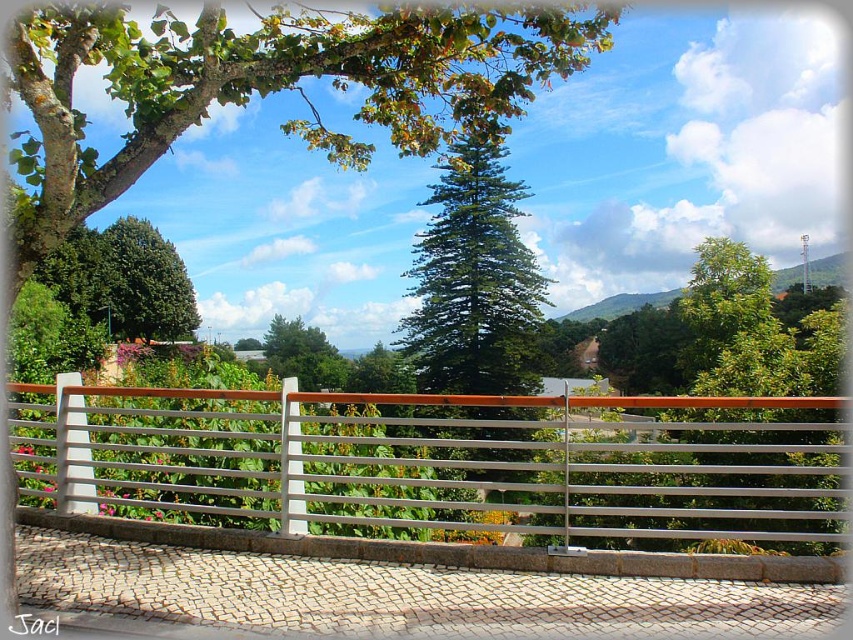
Question: Which point is farther to the camera?

Choices:
 (A) (784, 499)
 (B) (151, 337)

Answer: (B)

Question: Does silver metallic fence at center come behind green leafy tree at upper center?

Choices:
 (A) yes
 (B) no

Answer: (A)

Question: From the image, what is the correct spatial relationship of silver metallic fence at center in relation to green leafy tree at center?

Choices:
 (A) below
 (B) above

Answer: (A)

Question: Which point appears farthest from the camera in this image?

Choices:
 (A) (589, 438)
 (B) (442, 134)

Answer: (A)

Question: Does silver metallic fence at center appear on the left side of green leafy tree at upper center?

Choices:
 (A) yes
 (B) no

Answer: (B)

Question: Which object is positioned farthest from the silver metallic fence at center?

Choices:
 (A) green leafy tree at upper center
 (B) green leafy tree at center
 (C) green textured pine tree at center

Answer: (B)